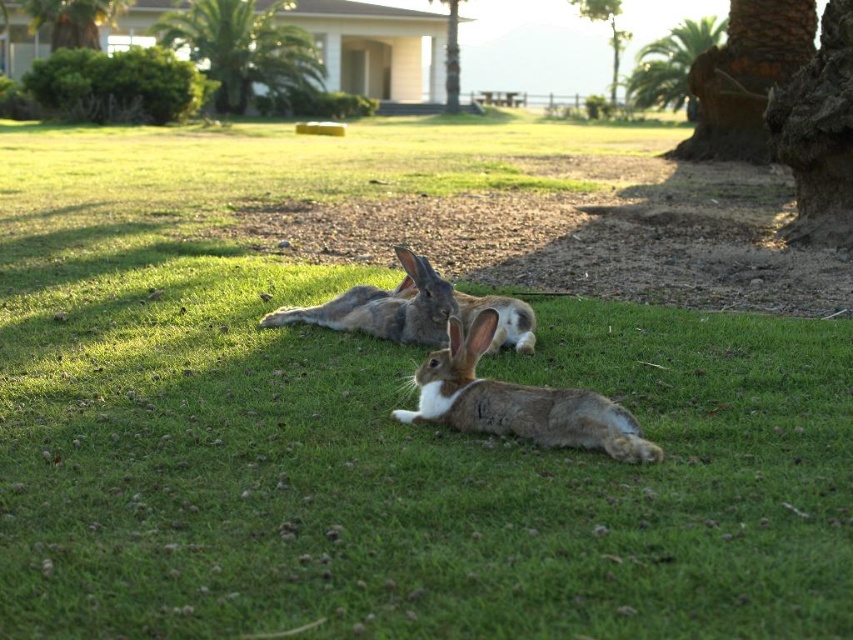
Question: Does fuzzy brown rabbit at center have a smaller size compared to green leafy palm tree at upper right?

Choices:
 (A) no
 (B) yes

Answer: (B)

Question: Estimate the real-world distances between objects in this image. Which object is closer to the brown furry rabbit at center?

Choices:
 (A) green leafy palm tree at upper left
 (B) green leafy palm tree at upper right
 (C) fuzzy brown rabbit at center
 (D) green leafy palm tree at upper center

Answer: (C)

Question: Considering the relative positions of green leafy palm tree at upper center and fuzzy brown rabbit at center in the image provided, where is green leafy palm tree at upper center located with respect to fuzzy brown rabbit at center?

Choices:
 (A) right
 (B) left

Answer: (B)

Question: Estimate the real-world distances between objects in this image. Which object is closer to the green leafy palm tree at upper right?

Choices:
 (A) brown furry rabbit at center
 (B) fuzzy brown rabbit at center
 (C) green leafy palm tree at upper left

Answer: (C)

Question: Which point is closer to the camera?

Choices:
 (A) green leafy palm tree at upper left
 (B) brown furry rabbit at center
 (C) fuzzy brown rabbit at center

Answer: (B)

Question: Is brown furry rabbit at center positioned at the back of green leafy palm tree at upper right?

Choices:
 (A) yes
 (B) no

Answer: (B)